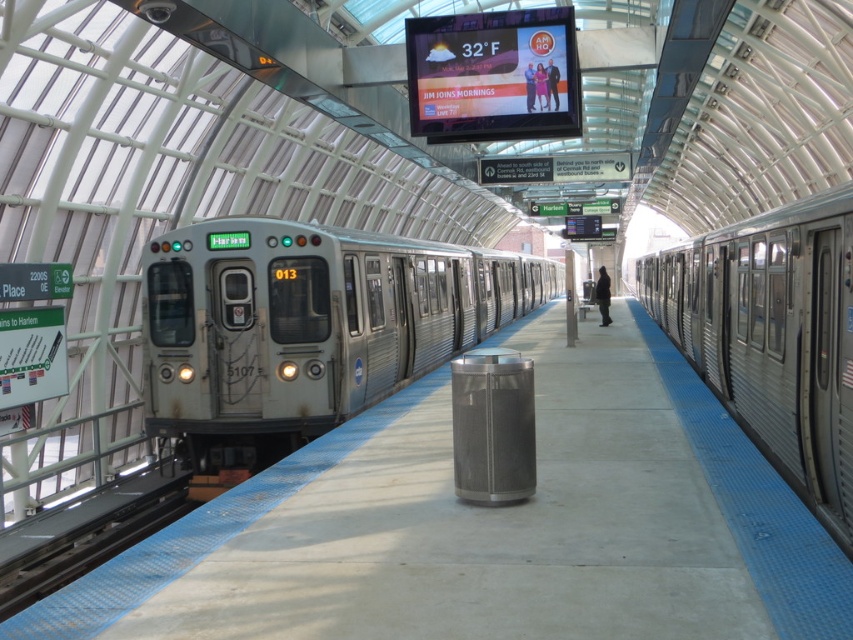
You are a subway engineer inspecting the platform. You need to locate the rusty metal train at center. Where is it positioned in terms of coordinates?

The rusty metal train at center is positioned at coordinates point (305, 328).

You are a passenger waiting at the subway station. You notice two trains on the platform. Which one is larger in size between the rusty metal train at center and the silver metallic train at right?

The rusty metal train at center is bigger than the silver metallic train at right.